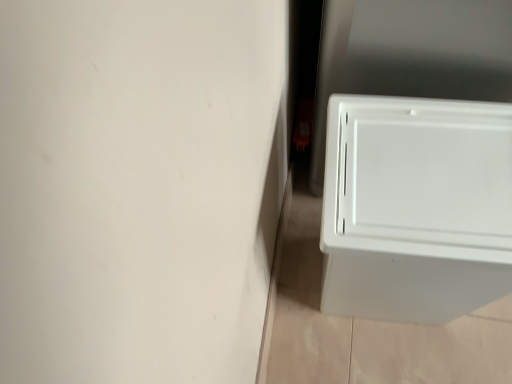
Where is `white plastic storage bin at lower right`? The image size is (512, 384). white plastic storage bin at lower right is located at coordinates (416, 207).

This screenshot has height=384, width=512. What do you see at coordinates (416, 207) in the screenshot?
I see `white plastic storage bin at lower right` at bounding box center [416, 207].

Identify the location of white plastic storage bin at lower right. This screenshot has width=512, height=384. (416, 207).